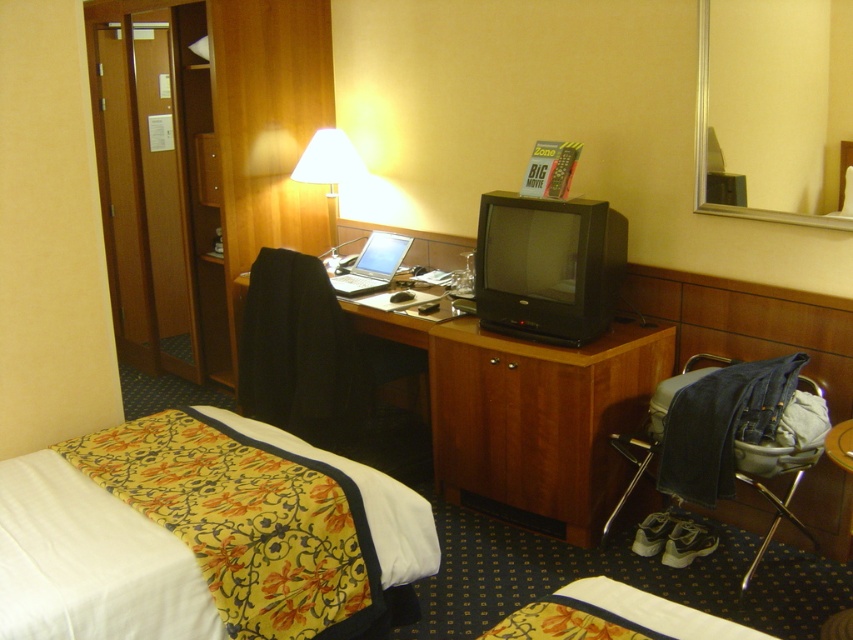
Is point (239, 372) positioned in front of point (335, 170)?

Yes, it is in front of point (335, 170).

Does black fabric chair at center have a greater height compared to white fabric lampshade at upper center?

Correct, black fabric chair at center is much taller as white fabric lampshade at upper center.

Which is in front, point (376, 467) or point (323, 145)?

Point (376, 467)

Locate an element on the screen. black fabric chair at center is located at coordinates (323, 369).

Can you confirm if floral fabric bed at lower left is positioned below wooden drawer at center?

Yes, floral fabric bed at lower left is below wooden drawer at center.

In order to click on floral fabric bed at lower left in this screenshot , I will do `click(202, 534)`.

Measure the distance between point [415,515] and camera.

Point [415,515] is 7.44 feet from camera.

This screenshot has height=640, width=853. I want to click on floral fabric bed at lower left, so click(202, 534).

From the picture: Does denim fabric chair at lower right have a lesser width compared to silver metallic laptop at center?

No, denim fabric chair at lower right is not thinner than silver metallic laptop at center.

Between denim fabric chair at lower right and silver metallic laptop at center, which one has less height?

Standing shorter between the two is silver metallic laptop at center.

Image resolution: width=853 pixels, height=640 pixels. Identify the location of denim fabric chair at lower right. (726, 436).

Identify the location of denim fabric chair at lower right. (726, 436).